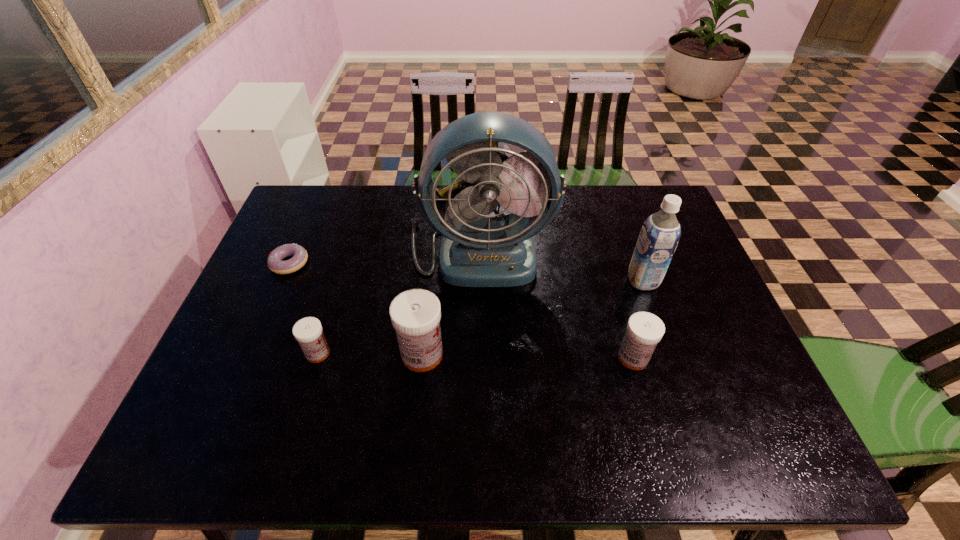
You are a GUI agent. You are given a task and a screenshot of the screen. Output one action in this format:
    pyautogui.click(x=<x>, y=<y>)
    Task: Click on the doughnut
    The image size is (960, 540).
    Given the screenshot: What is the action you would take?
    pyautogui.click(x=274, y=261)

Where is `free point located 0.300m on the right of the shortest medicine`? free point located 0.300m on the right of the shortest medicine is located at coordinates (455, 353).

I want to click on vacant space located on the back of the second medicine from left to right, so click(x=429, y=289).

This screenshot has width=960, height=540. Identify the location of vacant space located 0.260m on the back of the fifth object from left to right. (608, 269).

Image resolution: width=960 pixels, height=540 pixels. I want to click on blank space located in front of the tallest object to blow air, so click(x=479, y=338).

Image resolution: width=960 pixels, height=540 pixels. Find the location of `vacant area situated 0.100m on the label of the rightmost object`. vacant area situated 0.100m on the label of the rightmost object is located at coordinates (592, 281).

I want to click on vacant space situated on the label of the rightmost object, so click(x=586, y=281).

In order to click on free spot located 0.300m on the label of the rightmost object in this screenshot , I will do `click(520, 281)`.

This screenshot has width=960, height=540. What are the coordinates of `vacant area situated on the right of the leftmost object` in the screenshot? It's located at (440, 264).

Locate an element on the screen. object that is positioned at the far edge is located at coordinates (476, 251).